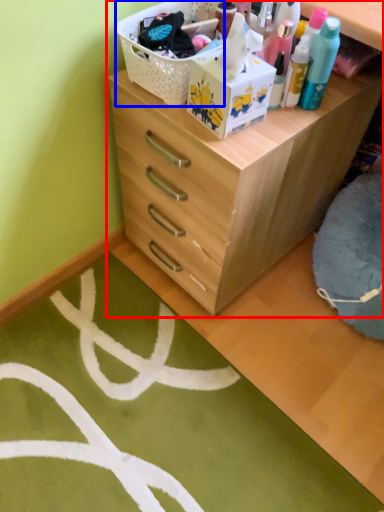
Question: Which object appears farthest to the camera in this image, chest of drawers (highlighted by a red box) or basket (highlighted by a blue box)?

Choices:
 (A) chest of drawers
 (B) basket

Answer: (B)